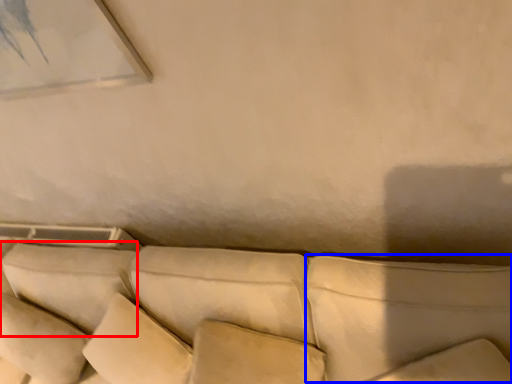
Question: Which object appears farthest to the camera in this image, pillow (highlighted by a red box) or pillow (highlighted by a blue box)?

Choices:
 (A) pillow
 (B) pillow

Answer: (A)